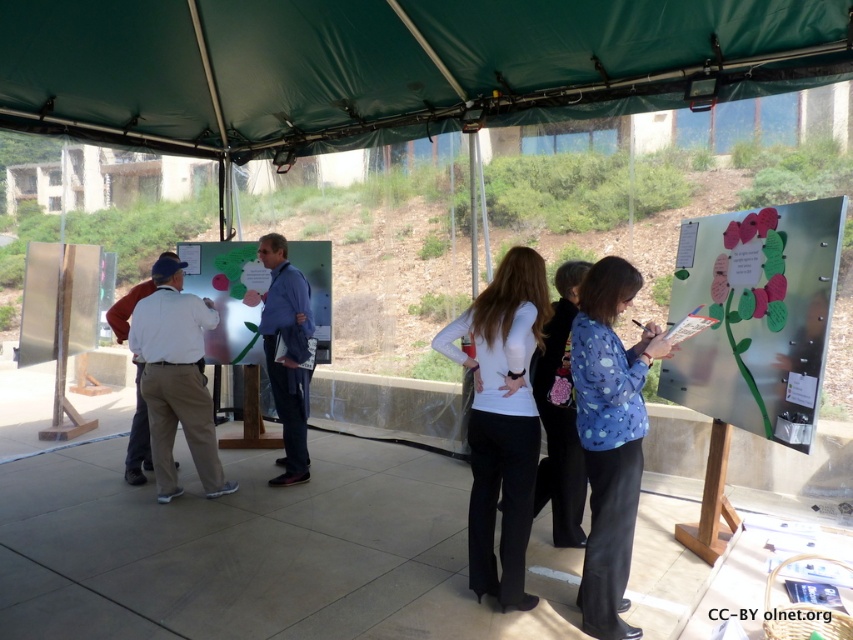
Between white matte shirt at center and blue shirt at center, which one is positioned higher?

blue shirt at center is above.

Which is in front, point (495, 564) or point (291, 339)?

Positioned in front is point (495, 564).

Identify the location of white matte shirt at center. This screenshot has width=853, height=640. (502, 420).

Between white cotton shirt at left and matte white board at center, which one is positioned higher?

matte white board at center

Describe the element at coordinates (177, 378) in the screenshot. I see `white cotton shirt at left` at that location.

Image resolution: width=853 pixels, height=640 pixels. I want to click on white cotton shirt at left, so click(177, 378).

Does metallic flower at right appear on the left side of blue shirt at center?

No, metallic flower at right is not to the left of blue shirt at center.

Is point (776, 317) farther from camera compared to point (281, 260)?

No, it is not.

You are a GUI agent. You are given a task and a screenshot of the screen. Output one action in this format:
    pyautogui.click(x=<x>, y=<y>)
    Task: Click on the metallic flower at right
    
    Given the screenshot: What is the action you would take?
    pyautogui.click(x=756, y=316)